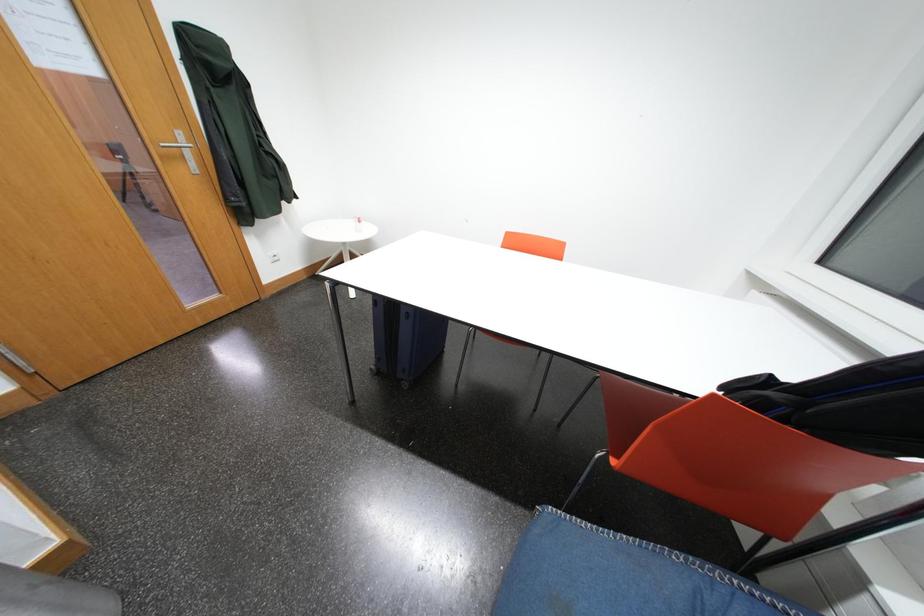
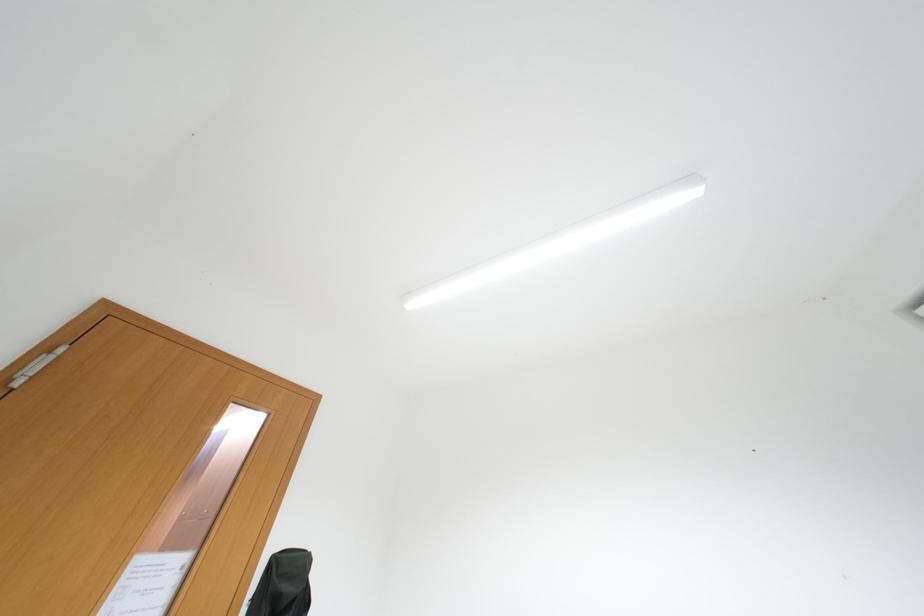
Question: The images are taken continuously from a first-person perspective. In which direction is your viewpoint rotating?

Choices:
 (A) Left
 (B) Right
 (C) Up
 (D) Down

Answer: (C)